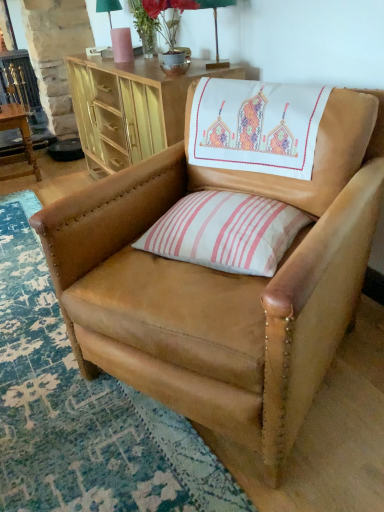
Question: Is green fabric table lamp at upper center, the second table lamp in the back-to-front sequence, inside the boundaries of matte gold desk at upper center, or outside?

Choices:
 (A) inside
 (B) outside

Answer: (B)

Question: Based on their sizes in the image, would you say green fabric table lamp at upper center, placed as the 2th table lamp when sorted from left to right, is bigger or smaller than matte gold desk at upper center?

Choices:
 (A) small
 (B) big

Answer: (A)

Question: Which is nearer to the green fabric lampshade at upper center, which is counted as the first table lamp, starting from the back?

Choices:
 (A) matte gold desk at upper center
 (B) green fabric table lamp at upper center, the 1th table lamp ordered from the bottom
 (C) pink striped fabric pillow at center
 (D) tan leather chair at center
 (E) wooden table at lower left

Answer: (A)

Question: Based on their relative distances, which object is farther from the matte gold desk at upper center?

Choices:
 (A) pink striped fabric pillow at center
 (B) tan leather chair at center
 (C) green fabric table lamp at upper center, placed as the first table lamp when sorted from front to back
 (D) wooden table at lower left
 (E) green fabric lampshade at upper center, arranged as the 1th table lamp when viewed from the top

Answer: (D)